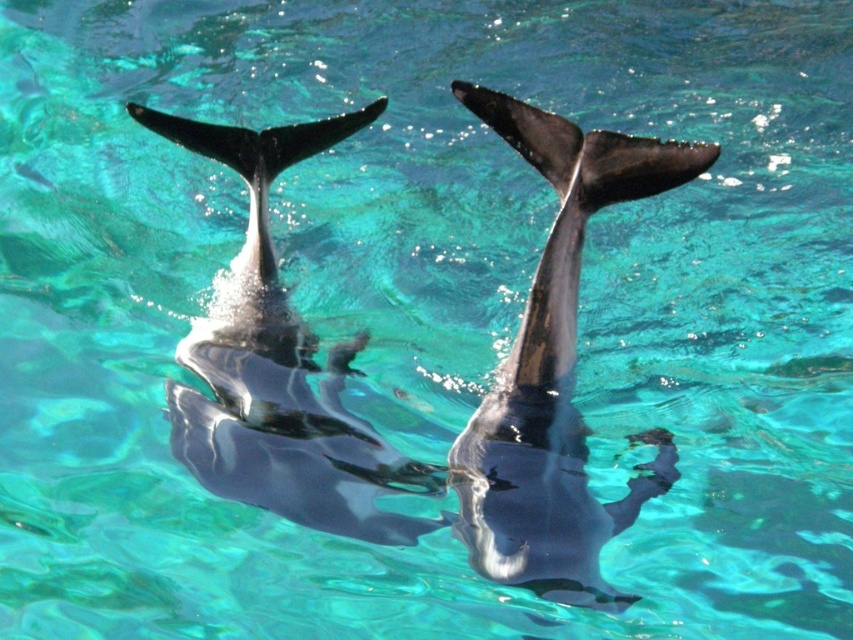
You are a marine biologist observing two dolphins in the water. You notice a glossy black dolphin at center and a shiny black dolphin at center. Which dolphin is located above the other?

The glossy black dolphin at center is positioned over the shiny black dolphin at center.

You are a marine biologist observing dolphins in the turquoise water. You notice a point at coordinates (555, 371). What is located at that point?

At point (555, 371) lies the glossy black dolphin at center.

You are a marine biologist observing two dolphins in a turquoise water scene. You notice a glossy black dolphin at center and a shiny black dolphin at center. Which dolphin is larger?

The shiny black dolphin at center is larger than the glossy black dolphin at center.